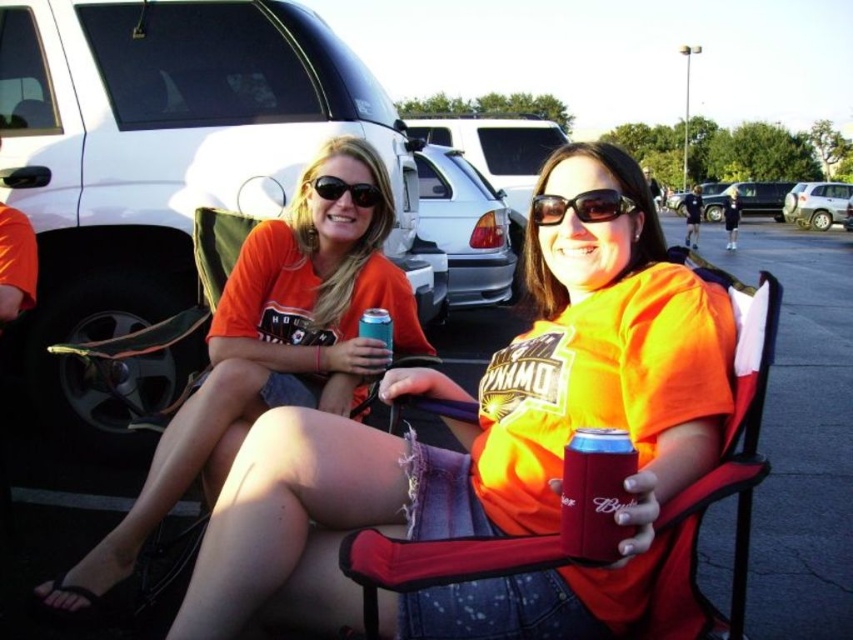
Based on the scene description, where is the orange cotton shirt at center located in terms of coordinates?

The orange cotton shirt at center is located at coordinates point (492, 449).

You are a photographer trying to capture a clear shot of the metallic silver can at center and the sunglasses at center. Which object should you focus on first to ensure it appears sharp in the photo?

The metallic silver can at center is in front of sunglasses at center, so you should focus on the metallic silver can at center first to ensure it appears sharp in the photo.

You are standing 1 meter away from the orange fabric shirt at center. You want to take a photo of it using a camera that has a minimum focusing distance of 1.5 meters. Can you take a clear photo without moving closer?

The orange fabric shirt at center and camera are 1.66 meters apart from each other. Since you are 1 meter away from the shirt, the total distance between you and the camera would be 2.66 meters. The camera requires a minimum focusing distance of 1.5 meters, so you can take a clear photo without moving closer.